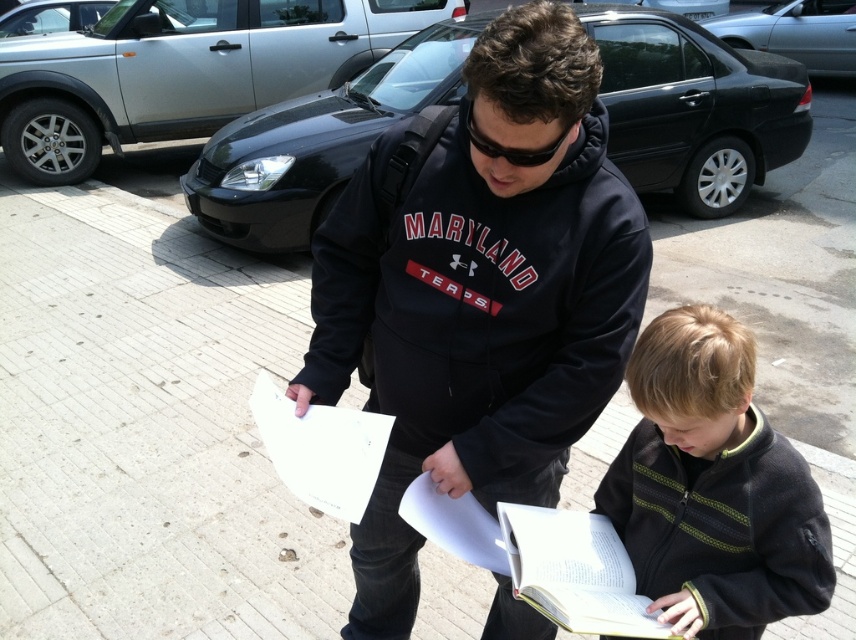
Question: Can you confirm if dark gray fleece jacket at lower right is wider than white paper book at lower right?

Choices:
 (A) no
 (B) yes

Answer: (A)

Question: Which object is the closest to the black fleece sweatshirt at center?

Choices:
 (A) white paper book at lower right
 (B) white paper at center
 (C) dark gray fleece jacket at lower right

Answer: (A)

Question: Which is nearer to the white paper at center?

Choices:
 (A) dark gray fleece jacket at lower right
 (B) white paper book at lower right
 (C) black fleece sweatshirt at center

Answer: (B)

Question: Estimate the real-world distances between objects in this image. Which object is closer to the white paper book at lower right?

Choices:
 (A) white paper at center
 (B) dark gray fleece jacket at lower right
 (C) black fleece sweatshirt at center

Answer: (B)

Question: Does black fleece sweatshirt at center appear on the right side of white paper at center?

Choices:
 (A) no
 (B) yes

Answer: (B)

Question: Can you confirm if black fleece sweatshirt at center is positioned to the left of white paper at center?

Choices:
 (A) no
 (B) yes

Answer: (A)